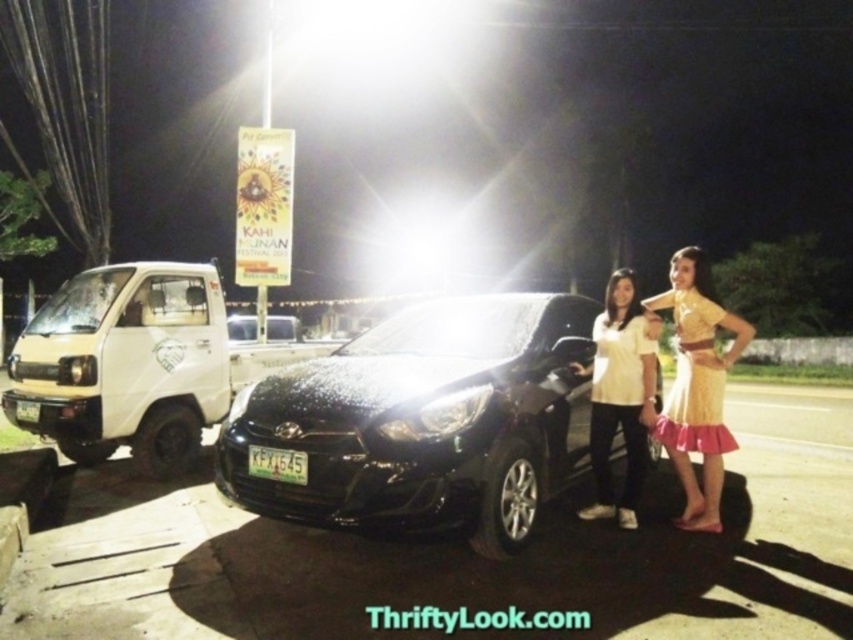
You are a GUI agent. You are given a task and a screenshot of the screen. Output one action in this format:
    pyautogui.click(x=<x>, y=<y>)
    Task: Click on the black glossy car at center
    
    Given the screenshot: What is the action you would take?
    pyautogui.click(x=422, y=422)

The image size is (853, 640). What do you see at coordinates (422, 422) in the screenshot?
I see `black glossy car at center` at bounding box center [422, 422].

This screenshot has width=853, height=640. Identify the location of black glossy car at center. (422, 422).

Which of these two, black glossy car at center or white matte shirt at center, stands taller?

white matte shirt at center

Can you confirm if black glossy car at center is taller than white matte shirt at center?

Incorrect, black glossy car at center's height is not larger of white matte shirt at center's.

Where is `black glossy car at center`? black glossy car at center is located at coordinates (422, 422).

Is yellow satin dress at right smaller than white matte shirt at center?

Incorrect, yellow satin dress at right is not smaller in size than white matte shirt at center.

Can you confirm if yellow satin dress at right is wider than white matte shirt at center?

Correct, the width of yellow satin dress at right exceeds that of white matte shirt at center.

This screenshot has width=853, height=640. Find the location of `yellow satin dress at right`. yellow satin dress at right is located at coordinates point(695,385).